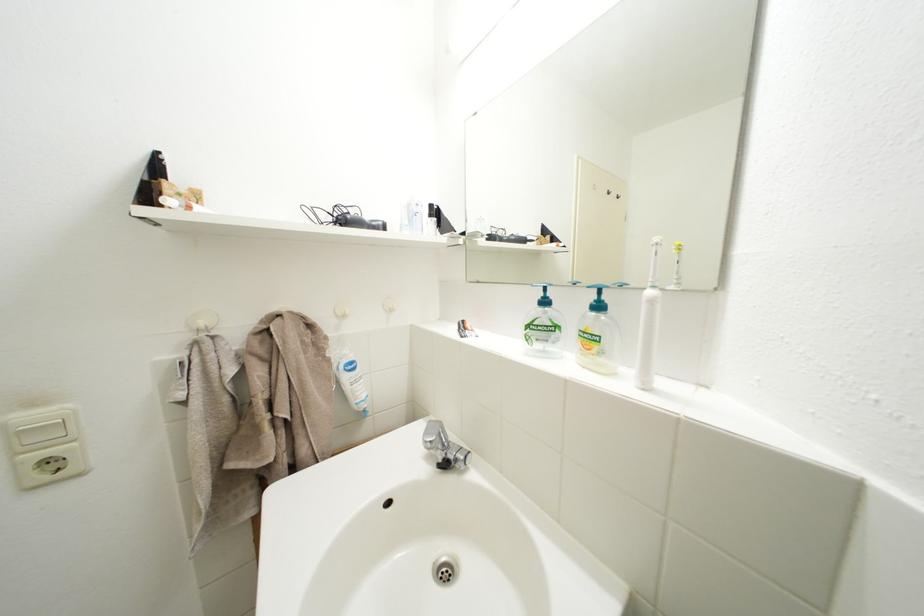
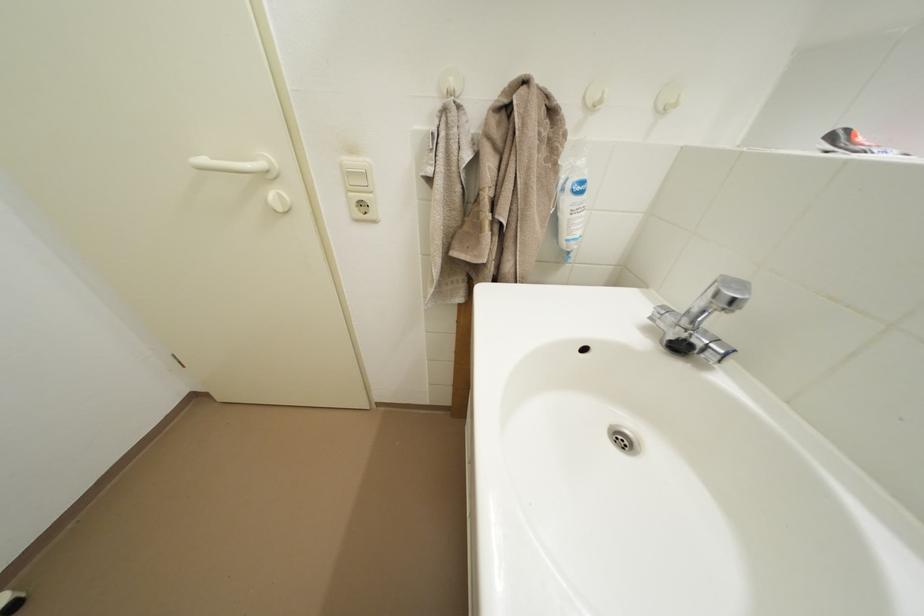
First-person continuous shooting, in which direction is the camera rotating?

The camera rotated toward left-down.